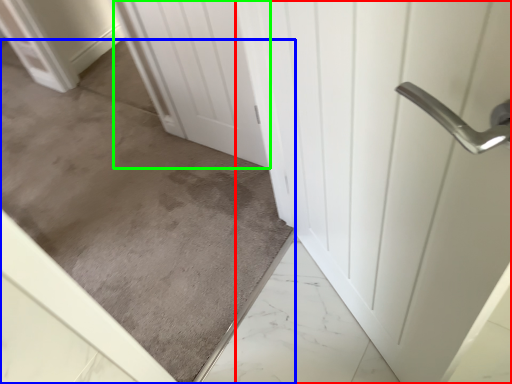
Question: Estimate the real-world distances between objects in this image. Which object is closer to door (highlighted by a red box), concrete (highlighted by a blue box) or door (highlighted by a green box)?

Choices:
 (A) concrete
 (B) door

Answer: (B)